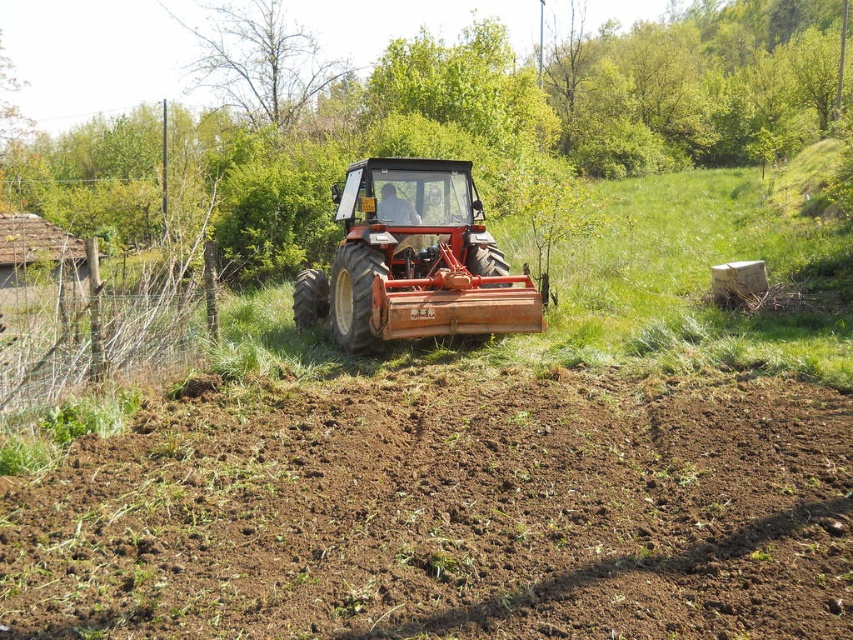
You are a farmer checking the field layout. You see the brown soil at center and the orange metal plow at center. Which object is positioned more to the left?

The brown soil at center is positioned more to the left than the orange metal plow at center.

You are standing at the origin point of the image, which is the bottom left corner. The tractor is moving forward. Where would you expect the tractor to be in relation to the brown soil at center after it moves forward a little?

The tractor is positioned slightly off center towards the left side of the frame, facing forward. The brown soil at center is located at point (448, 513). Since the tractor is moving forward, it will move towards the center of the image and would be closer to the brown soil at center after moving forward a little.

Based on the photo, you are standing at the center of the field and see two points marked in the image. Which point is closer to you, point (376,534) or point (430,164)?

Point (376,534) is in front of point (430,164), so it is closer to you.